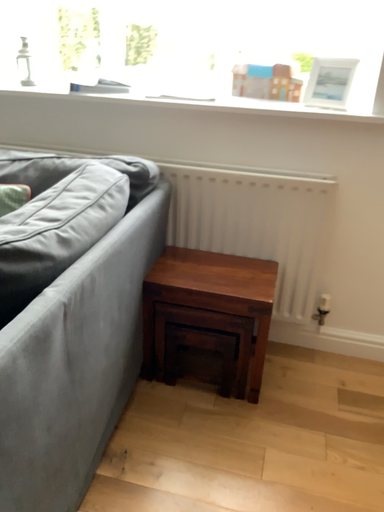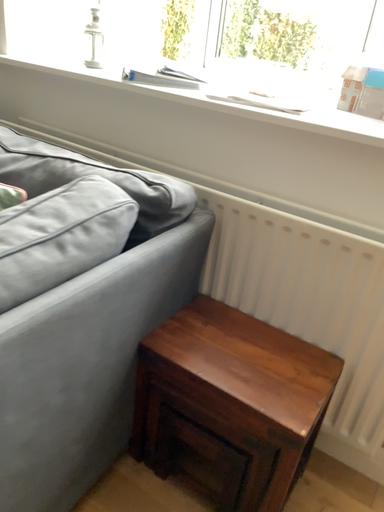
Question: How did the camera likely rotate when shooting the video?

Choices:
 (A) rotated right
 (B) rotated left

Answer: (B)